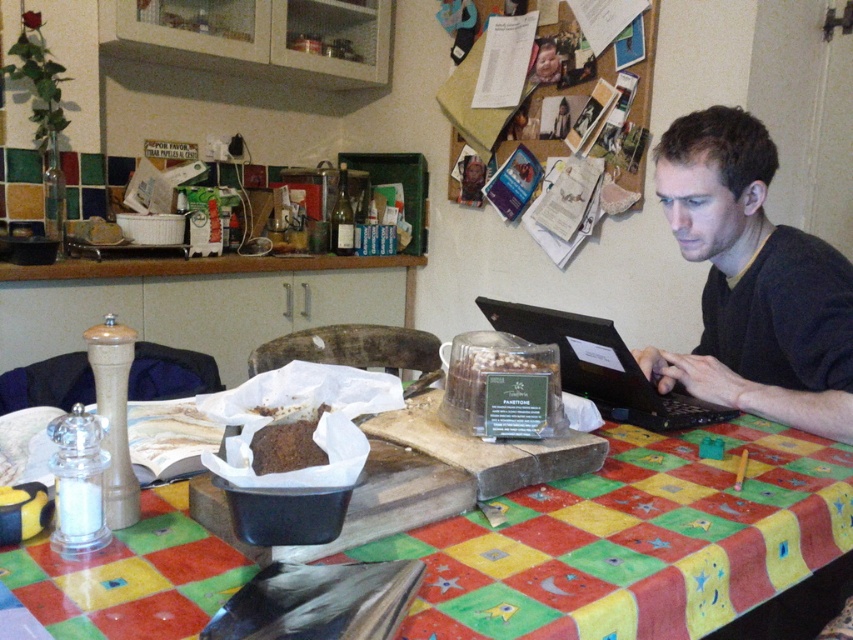
Question: Which object appears closest to the camera in this image?

Choices:
 (A) black plastic laptop at center
 (B) brown matte bread at center
 (C) multicolored fabric tablecloth at center
 (D) dark gray sweater at right

Answer: (C)

Question: Can you confirm if multicolored fabric tablecloth at center is positioned below brown matte bread at center?

Choices:
 (A) no
 (B) yes

Answer: (B)

Question: Considering the relative positions of multicolored fabric tablecloth at center and brown matte bread at center in the image provided, where is multicolored fabric tablecloth at center located with respect to brown matte bread at center?

Choices:
 (A) above
 (B) below

Answer: (B)

Question: Which point is closer to the camera taking this photo?

Choices:
 (A) (723, 365)
 (B) (183, 513)

Answer: (B)

Question: Which point is closer to the camera?

Choices:
 (A) (764, 307)
 (B) (326, 454)

Answer: (B)

Question: Is dark gray sweater at right below black plastic laptop at center?

Choices:
 (A) no
 (B) yes

Answer: (A)